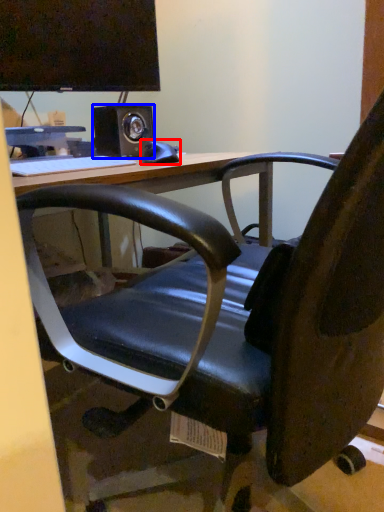
Question: Which of the following is the closest to the observer, equipment (highlighted by a red box) or speaker (highlighted by a blue box)?

Choices:
 (A) equipment
 (B) speaker

Answer: (A)